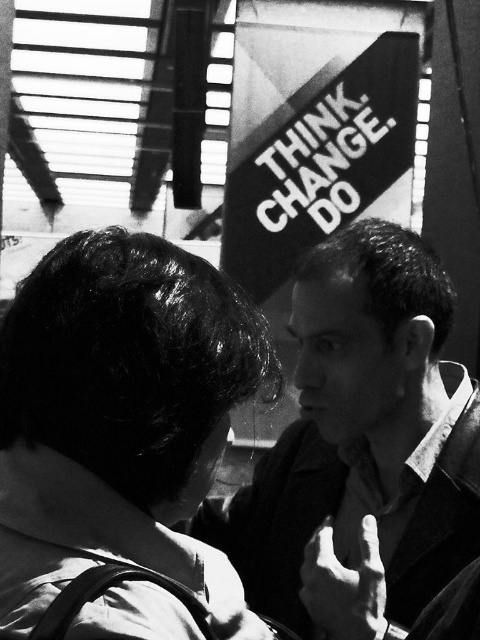
Who is lower down, dark hair at upper left or smooth black shirt at center?

smooth black shirt at center is below.

Locate an element on the screen. The image size is (480, 640). dark hair at upper left is located at coordinates (120, 417).

Measure the distance between point (48,294) and camera.

Point (48,294) and camera are 32.27 inches apart.

Identify the location of dark hair at upper left. (120, 417).

In the scene shown: Can you confirm if smooth black shirt at center is positioned to the left of smooth skin hand at center?

No, smooth black shirt at center is not to the left of smooth skin hand at center.

Does smooth black shirt at center have a lesser height compared to smooth skin hand at center?

In fact, smooth black shirt at center may be taller than smooth skin hand at center.

Is point (349, 237) positioned after point (360, 572)?

Yes, it is.

Where is `smooth black shirt at center`? smooth black shirt at center is located at coordinates (362, 433).

Where is `dark hair at upper left`? The height and width of the screenshot is (640, 480). dark hair at upper left is located at coordinates [x=120, y=417].

Can you confirm if dark hair at upper left is taller than smooth skin hand at center?

Yes, dark hair at upper left is taller than smooth skin hand at center.

Where is `dark hair at upper left`? The image size is (480, 640). dark hair at upper left is located at coordinates (120, 417).